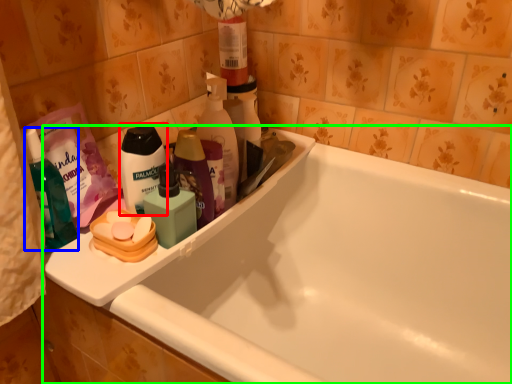
Question: Which is nearer to the personal care (highlighted by a red box)? toiletry (highlighted by a blue box) or bathtub (highlighted by a green box).

Choices:
 (A) toiletry
 (B) bathtub

Answer: (A)